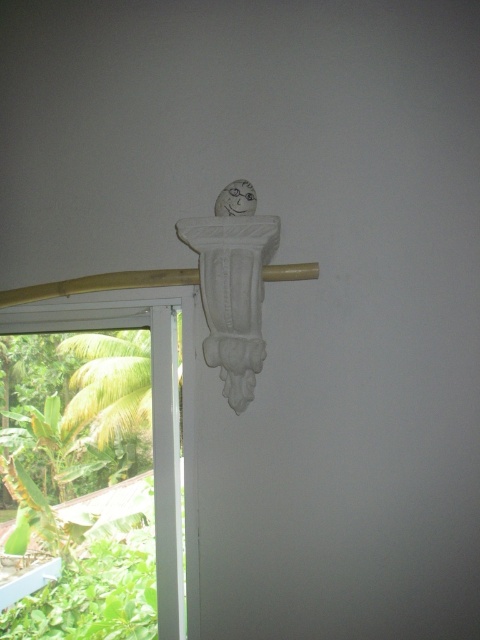
You are standing in the room and want to look outside through the transparent glass window at left. Which direction should you turn your head to see the white wood beam at upper center while still looking through the window?

You should turn your head to the right because the transparent glass window at left is to the left of the white wood beam at upper center, so moving your head toward the right will allow you to see both the window and the beam.

In the scene shown: You are standing in the room looking at the white wood beam at upper center and the transparent glass window at left. Which object is closer to you?

The transparent glass window at left is closer to you because the white wood beam at upper center is behind it.